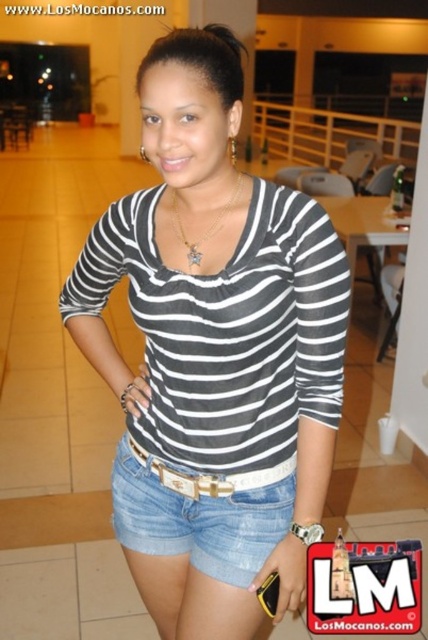
You are taking a photo of the scene and want to focus on both point (217, 259) and point (143, 524). Which point should you adjust your focus to first to ensure both are in clear view?

Point (217, 259) is closer to the camera than point (143, 524), so you should focus on point (217, 259) first to ensure both are in clear view.

You are a photographer trying to capture a closeup of the striped fabric shirt at center. You have a camera that requires a minimum distance of 36 inches to focus properly. Can you take the photo without moving either the camera or the shirt?

The striped fabric shirt at center and camera are 36.31 inches apart, which is just over the required 36 inches. Therefore, you can take the photo without moving either the camera or the shirt.

You are a fashion designer observing a person in a casual setting. You notice the striped fabric shirt at center and the denim shorts at center. Which clothing item is positioned more to the left?

The striped fabric shirt at center is positioned more to the left than the denim shorts at center.